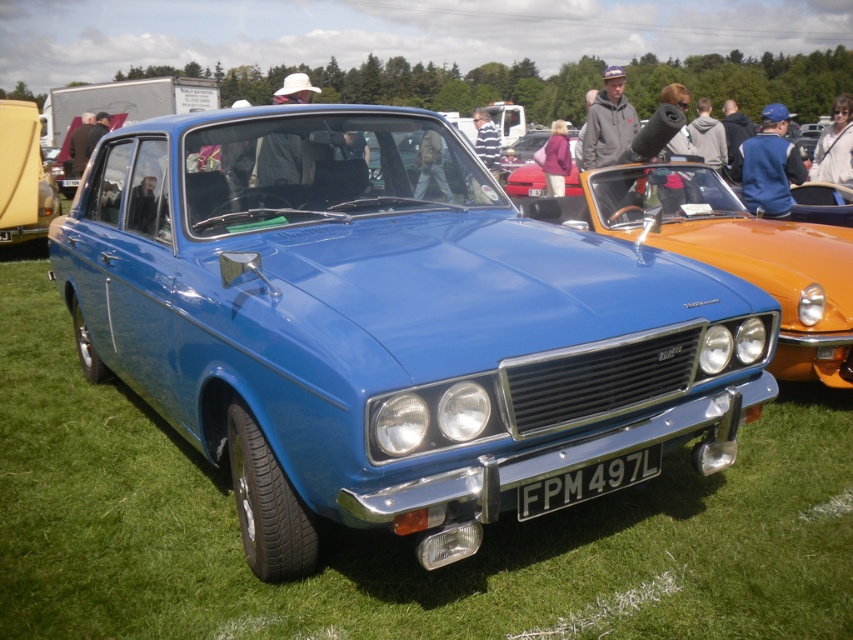
Question: Is green grass at center thinner than white plastic license plate at center?

Choices:
 (A) no
 (B) yes

Answer: (A)

Question: Which of the following is the closest to the observer?

Choices:
 (A) white plastic license plate at center
 (B) green grass at center

Answer: (A)

Question: Does green grass at center appear over white plastic license plate at center?

Choices:
 (A) yes
 (B) no

Answer: (B)

Question: Observing the image, what is the correct spatial positioning of green grass at center in reference to white plastic license plate at center?

Choices:
 (A) below
 (B) above

Answer: (A)